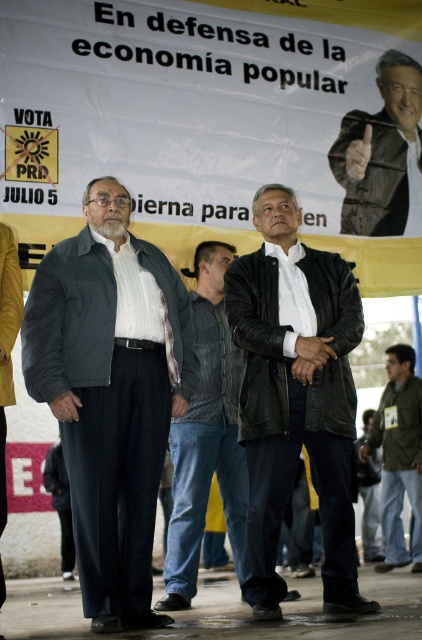
You are a photographer at the political rally. You need to capture both the dark gray jacket at center and the green matte jacket at lower right in a single frame. Which jacket should you focus on to ensure both are in the frame without zooming in or out?

The dark gray jacket at center is smaller than the green matte jacket at lower right, so focusing on the green matte jacket at lower right would allow both to be captured in the frame without needing to adjust the zoom.

You are a photographer at the political rally. You need to capture a photo where both the brown leather jacket at upper right and the dark gray pants at lower left are visible. Which object should you focus on first to ensure both are in frame?

You should focus on the dark gray pants at lower left first because it is larger than the brown leather jacket at upper right, ensuring there is enough space in the frame for both.